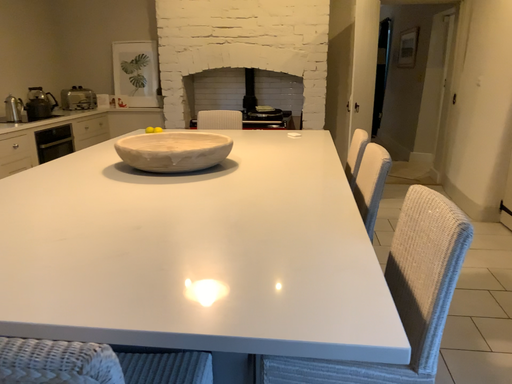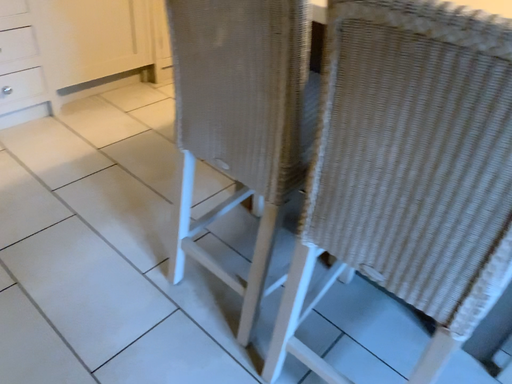
Question: How did the camera likely rotate when shooting the video?

Choices:
 (A) rotated downward
 (B) rotated upward

Answer: (A)